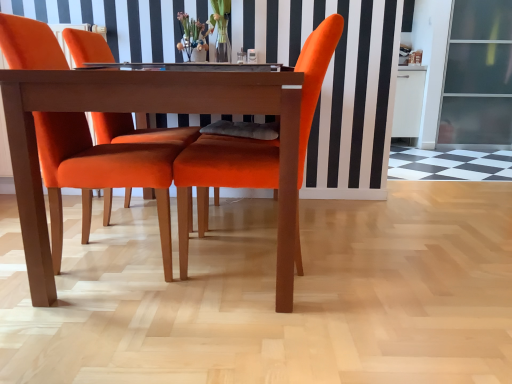
Where is `vacant area that is in front of velvet orange chair at center, which is counted as the 2th chair, starting from the left`? The height and width of the screenshot is (384, 512). vacant area that is in front of velvet orange chair at center, which is counted as the 2th chair, starting from the left is located at coordinates click(x=257, y=331).